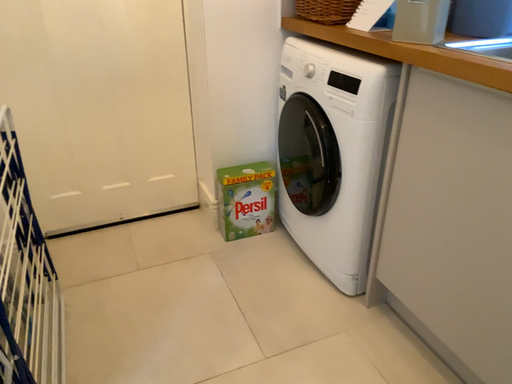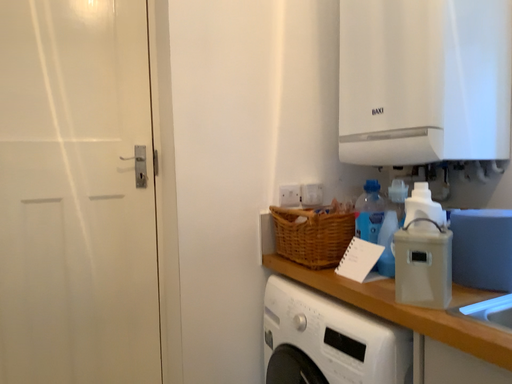
Question: How did the camera likely rotate when shooting the video?

Choices:
 (A) rotated downward
 (B) rotated upward

Answer: (B)